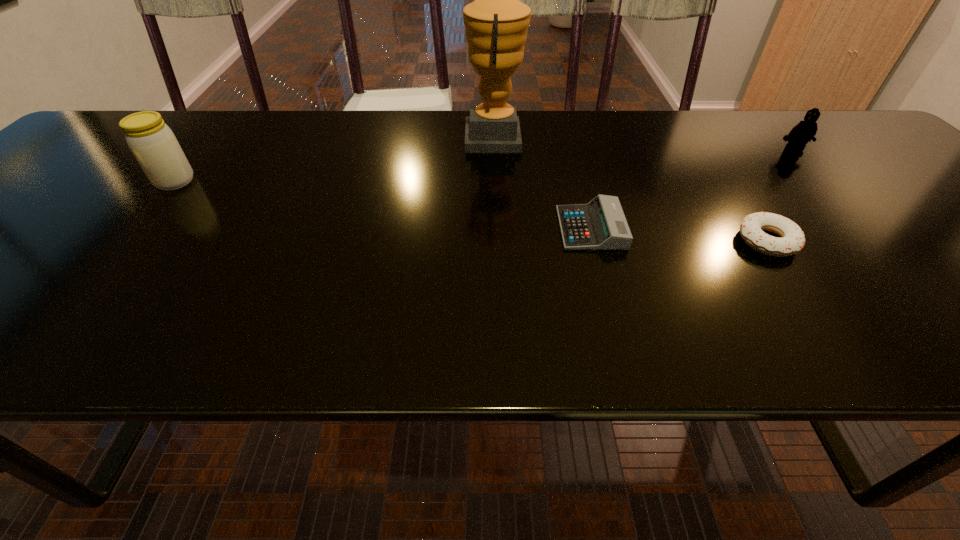
Locate an element on the screen. The height and width of the screenshot is (540, 960). vacant region located at the front of the tallest object with handles is located at coordinates (396, 138).

At what (x,y) coordinates should I click in order to perform the action: click on vacant region located 0.090m on the left of the leftmost object. Please return your answer as a coordinate pair (x, y). The width and height of the screenshot is (960, 540). Looking at the image, I should click on (116, 181).

Locate an element on the screen. This screenshot has width=960, height=540. free space located on the face of the rightmost object is located at coordinates (828, 191).

Locate an element on the screen. Image resolution: width=960 pixels, height=540 pixels. vacant space situated on the back of the second object from right to left is located at coordinates (723, 176).

Locate an element on the screen. The width and height of the screenshot is (960, 540). blank space located on the front of the third object from left to right is located at coordinates [x=609, y=293].

Identify the location of award at the far edge. (496, 23).

The image size is (960, 540). Identify the location of Lego that is at the far edge. (804, 131).

This screenshot has width=960, height=540. I want to click on vacant space at the far edge, so click(636, 151).

Locate an element on the screen. The height and width of the screenshot is (540, 960). vacant space at the left edge is located at coordinates (69, 177).

This screenshot has height=540, width=960. Find the location of `vacant space at the right edge of the desktop`. vacant space at the right edge of the desktop is located at coordinates (886, 170).